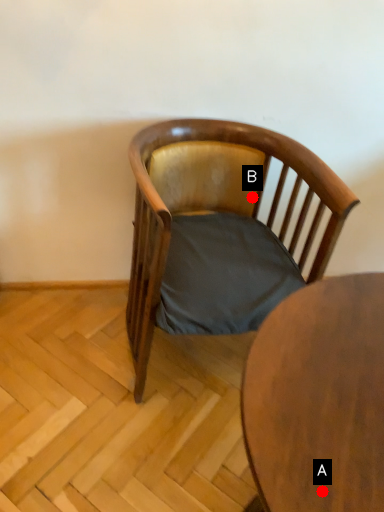
Question: Two points are circled on the image, labeled by A and B beside each circle. Which point is further to the camera?

Choices:
 (A) A is further
 (B) B is further

Answer: (B)